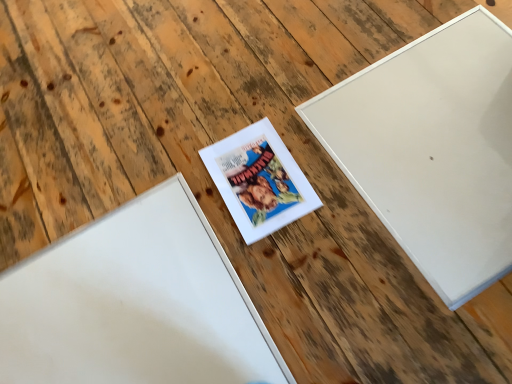
The image size is (512, 384). In order to click on vacant space in white matte picture frame at center, which is the second picture frame from left to right (from a real-world perspective) in this screenshot , I will do `click(259, 182)`.